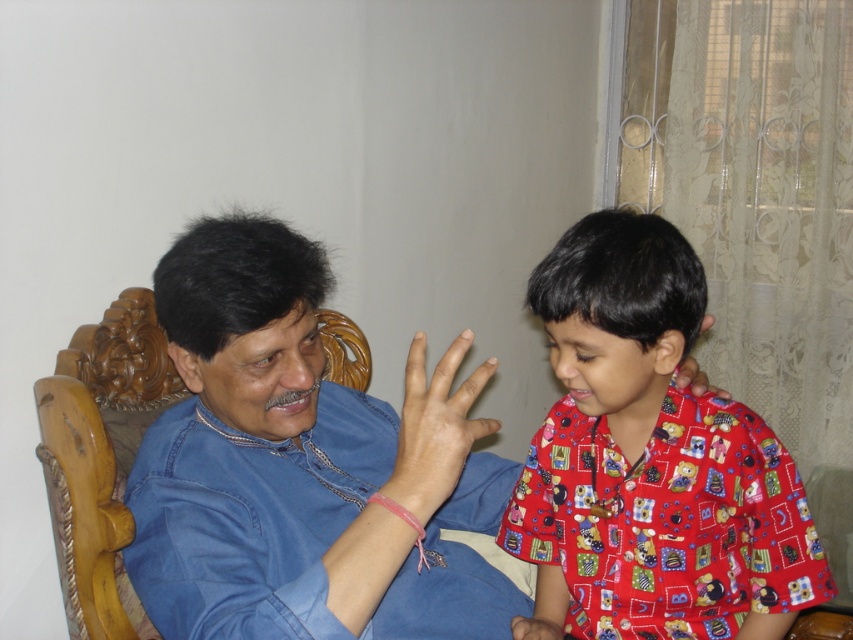
You are an interior designer analyzing the spatial arrangement of clothing items in the image. The printed cotton shirt at right is positioned at coordinates 0.720, 0.762. Can you determine if this placement aligns with standard clothing display guidelines that recommend shirts be placed between 0.6 and 0.8 on both axes for optimal visibility?

The printed cotton shirt at right is positioned at coordinates (648, 460), which falls within the recommended range of 0.6 to 0.8 on both axes. This placement aligns with standard clothing display guidelines for optimal visibility.

You are a tailor measuring a client for a new shirt. You notice the blue denim shirt at center and the smooth skin hand at center. Which object is bigger in size?

The blue denim shirt at center is larger in size compared to the smooth skin hand at center.

You are a photographer trying to take a photo of the blue denim shirt at center. The camera is 32.29 inches away from the shirt. Is the distance sufficient to capture the entire shirt in the frame?

The camera is 32.29 inches away from the blue denim shirt at center. Since the distance is provided, but without knowing the camera lens specifications or the shirt size, it is impossible to determine if the entire shirt can be captured. Additional information about the camera and shirt dimensions is needed for an accurate assessment.